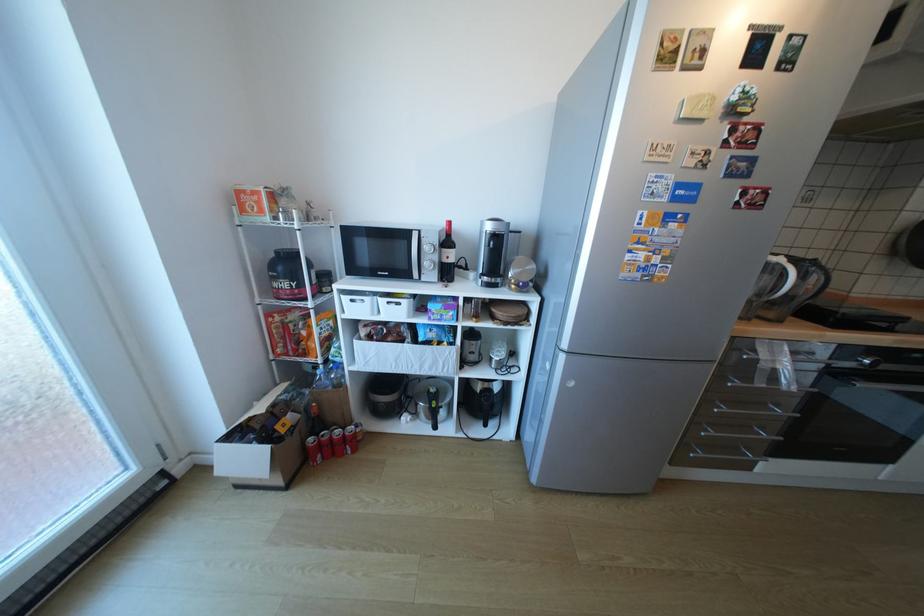
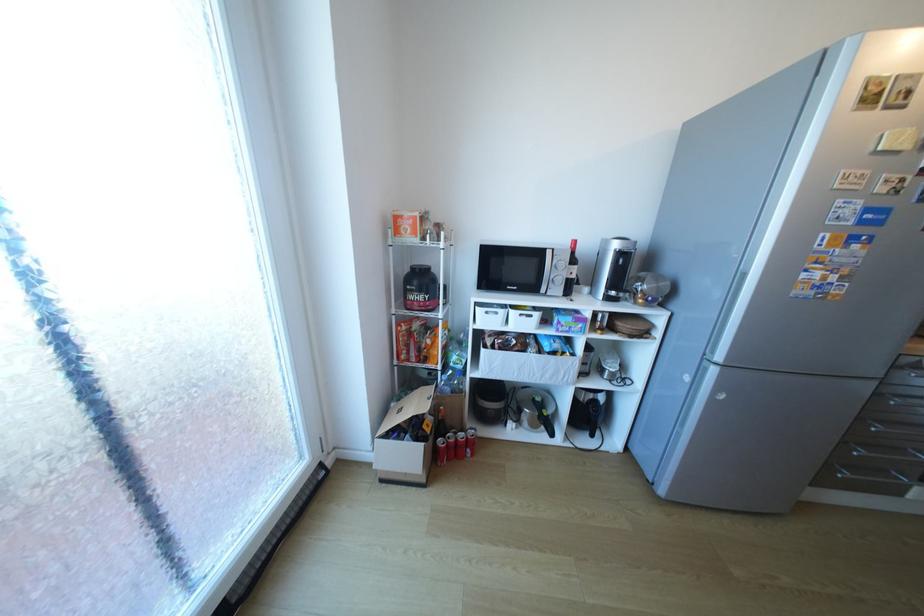
In the second image, find the point that corresponds to pixel 728 377 in the first image.

(886, 395)